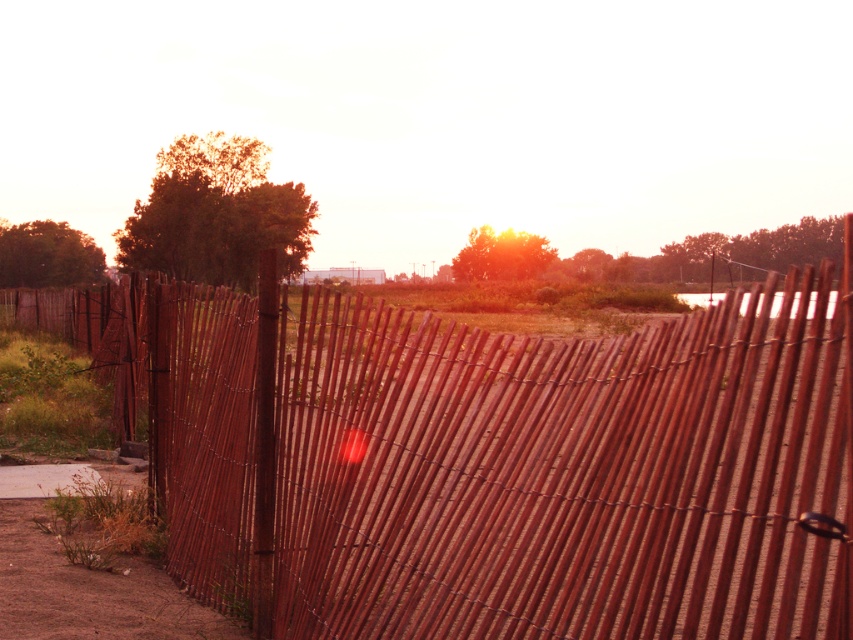
Between wooden fence at center and brown sandy dirt track at lower left, which one has less height?

brown sandy dirt track at lower left is shorter.

Does wooden fence at center have a smaller size compared to brown sandy dirt track at lower left?

Incorrect, wooden fence at center is not smaller in size than brown sandy dirt track at lower left.

What do you see at coordinates (492, 461) in the screenshot? Image resolution: width=853 pixels, height=640 pixels. I see `wooden fence at center` at bounding box center [492, 461].

I want to click on wooden fence at center, so click(x=492, y=461).